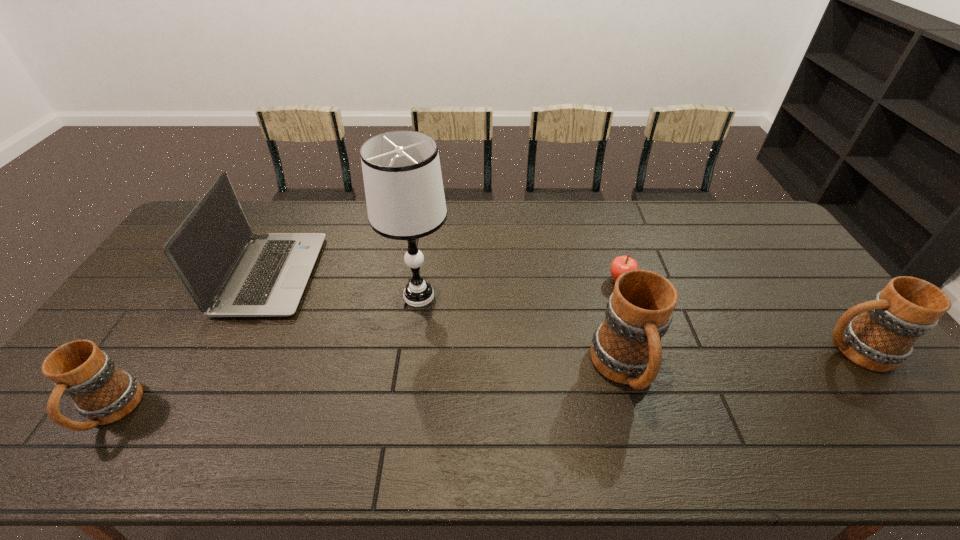
I want to click on vacant space located on the side of the rightmost mug with the handle, so click(x=731, y=350).

At what (x,y) coordinates should I click in order to perform the action: click on free space located on the side of the rightmost mug with the handle. Please return your answer as a coordinate pair (x, y). Looking at the image, I should click on (711, 350).

Locate an element on the screen. vacant space located 0.190m on the front of the shortest object is located at coordinates (639, 339).

Where is `vacant area situated 0.260m on the left of the third object from left to right`? The height and width of the screenshot is (540, 960). vacant area situated 0.260m on the left of the third object from left to right is located at coordinates (300, 296).

Locate an element on the screen. The width and height of the screenshot is (960, 540). vacant space situated on the screen of the laptop computer is located at coordinates (335, 275).

This screenshot has height=540, width=960. What are the coordinates of `object located at the far edge` in the screenshot? It's located at (230, 272).

Find the location of a particular element. object at the left edge is located at coordinates (102, 393).

The width and height of the screenshot is (960, 540). In order to click on object positioned at the right edge in this screenshot , I will do `click(882, 337)`.

At what (x,y) coordinates should I click in order to perform the action: click on object that is at the near left corner. Please return your answer as a coordinate pair (x, y). The height and width of the screenshot is (540, 960). Looking at the image, I should click on (102, 393).

Where is `free region at the far edge of the desktop`? This screenshot has height=540, width=960. free region at the far edge of the desktop is located at coordinates [x=276, y=232].